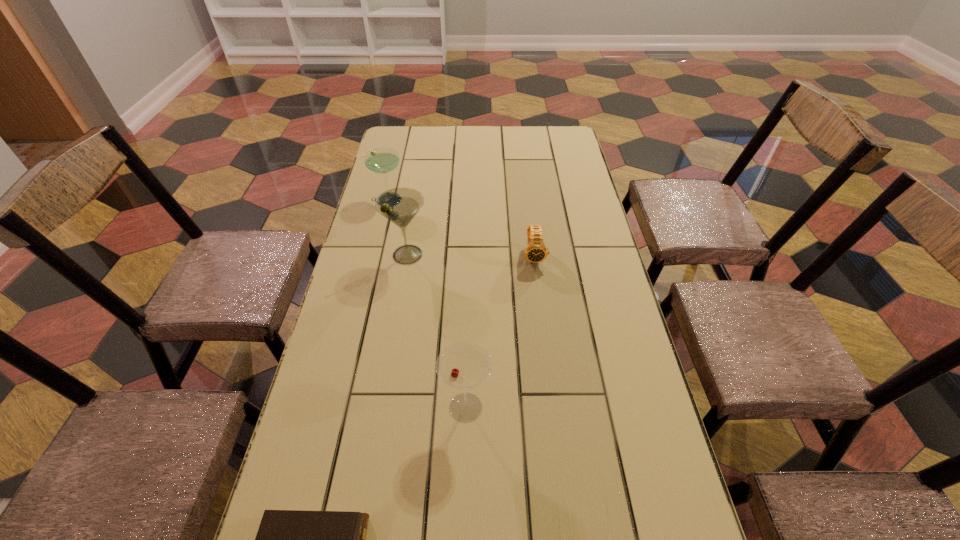
The height and width of the screenshot is (540, 960). Identify the location of the fourth closest object relative to the second shortest object. (286, 539).

Identify which object is located as the nearest to the fourth farthest object. Please provide its 2D coordinates. Your answer should be formatted as a tuple, i.e. [(x, y)], where the tuple contains the x and y coordinates of a point satisfying the conditions above.

[(286, 539)]

Select which martini appears as the closest to the farthest martini. Please provide its 2D coordinates. Your answer should be formatted as a tuple, i.e. [(x, y)], where the tuple contains the x and y coordinates of a point satisfying the conditions above.

[(399, 205)]

Find the location of a particular element. martini identified as the second closest to the farthest object is located at coordinates (464, 365).

Find the location of `free space that satisfies the following two spatial constraints: 1. on the front side of the tallest object; 2. on the right side of the farthest object`. free space that satisfies the following two spatial constraints: 1. on the front side of the tallest object; 2. on the right side of the farthest object is located at coordinates (374, 255).